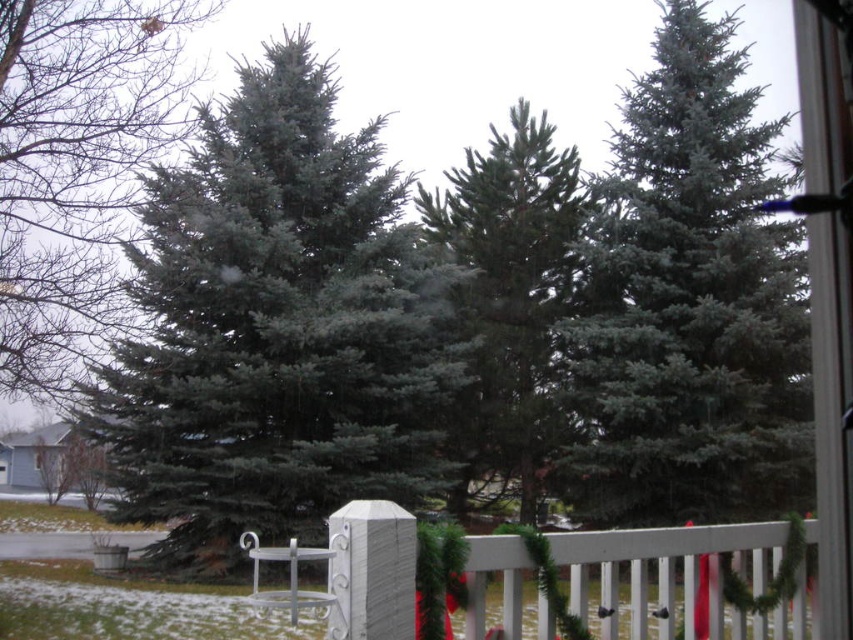
Which is above, green matte fir tree at upper center or green matte evergreen tree at left?

green matte fir tree at upper center is higher up.

Is green matte fir tree at upper center in front of green matte evergreen tree at left?

No.

Is point (640, 266) more distant than point (54, 179)?

Yes, it is behind point (54, 179).

The image size is (853, 640). In order to click on green matte fir tree at upper center in this screenshot , I will do `click(688, 304)`.

Does green matte fir tree at upper center have a lesser width compared to white wooden fence at lower center?

No, green matte fir tree at upper center is not thinner than white wooden fence at lower center.

Does green matte fir tree at upper center come in front of white wooden fence at lower center?

No, it is not.

You are a GUI agent. You are given a task and a screenshot of the screen. Output one action in this format:
    pyautogui.click(x=<x>, y=<y>)
    Task: Click on the green matte fir tree at upper center
    
    Given the screenshot: What is the action you would take?
    pyautogui.click(x=688, y=304)

Is green matte fir tree at left thinner than green matte fir tree at upper center?

Yes.

This screenshot has height=640, width=853. Describe the element at coordinates (277, 330) in the screenshot. I see `green matte fir tree at left` at that location.

Is point (299, 396) farther from camera compared to point (804, 365)?

Yes.

At what (x,y) coordinates should I click in order to perform the action: click on green matte fir tree at left. Please return your answer as a coordinate pair (x, y). Image resolution: width=853 pixels, height=640 pixels. Looking at the image, I should click on (277, 330).